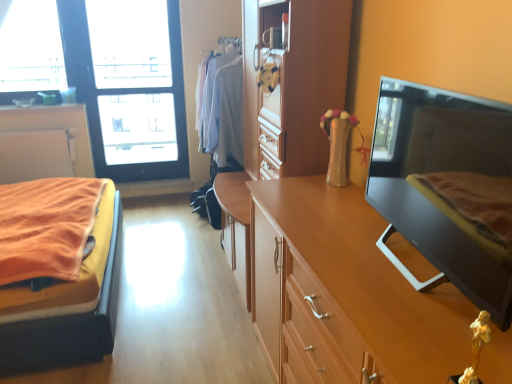
Question: Is black glossy tv at right outside wooden dresser at center?

Choices:
 (A) yes
 (B) no

Answer: (A)

Question: Does black glossy tv at right have a smaller size compared to wooden dresser at center?

Choices:
 (A) yes
 (B) no

Answer: (A)

Question: Is black glossy tv at right thinner than wooden dresser at center?

Choices:
 (A) no
 (B) yes

Answer: (B)

Question: Are black glossy tv at right and wooden dresser at center far apart?

Choices:
 (A) yes
 (B) no

Answer: (B)

Question: Does black glossy tv at right appear on the right side of wooden dresser at center?

Choices:
 (A) yes
 (B) no

Answer: (A)

Question: Relative to wooden cabinet at right, which is the 2th cabinetry in back-to-front order, is wooden dresser at center in front or behind?

Choices:
 (A) front
 (B) behind

Answer: (B)

Question: Would you say wooden dresser at center is to the left or to the right of wooden cabinet at right, the 1th cabinetry in the front-to-back sequence, in the picture?

Choices:
 (A) right
 (B) left

Answer: (B)

Question: Considering the positions of wooden dresser at center and wooden cabinet at right, arranged as the second cabinetry when viewed from the left, in the image, is wooden dresser at center bigger or smaller than wooden cabinet at right, arranged as the second cabinetry when viewed from the left,?

Choices:
 (A) big
 (B) small

Answer: (A)

Question: Does point (301, 127) appear closer or farther from the camera than point (359, 365)?

Choices:
 (A) farther
 (B) closer

Answer: (A)

Question: In terms of height, does wooden dresser at center look taller or shorter compared to transparent glass window at upper left?

Choices:
 (A) short
 (B) tall

Answer: (B)

Question: Choose the correct answer: Is wooden dresser at center inside transparent glass window at upper left or outside it?

Choices:
 (A) inside
 (B) outside

Answer: (B)

Question: From the image's perspective, is wooden dresser at center above or below transparent glass window at upper left?

Choices:
 (A) below
 (B) above

Answer: (A)

Question: From a real-world perspective, relative to transparent glass window at upper left, is wooden dresser at center vertically above or below?

Choices:
 (A) below
 (B) above

Answer: (A)

Question: From a real-world perspective, is transparent glass window at upper left above or below wooden dresser at center?

Choices:
 (A) above
 (B) below

Answer: (A)

Question: Considering the positions of transparent glass window at upper left and wooden dresser at center in the image, is transparent glass window at upper left taller or shorter than wooden dresser at center?

Choices:
 (A) tall
 (B) short

Answer: (B)